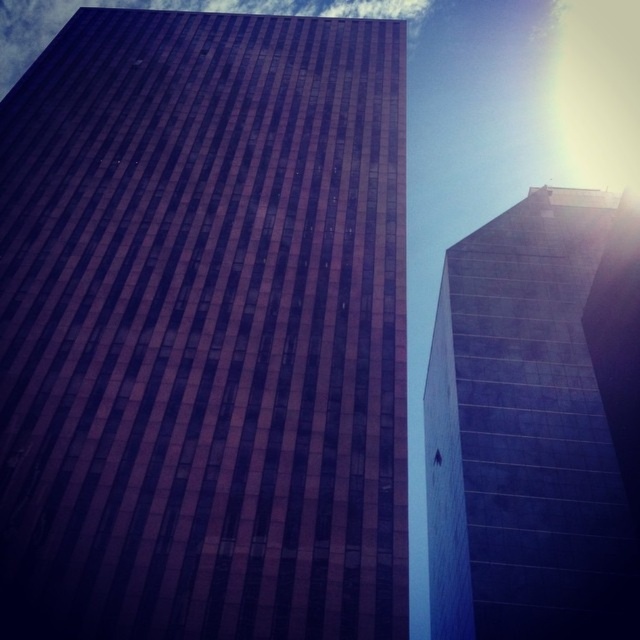
Is point (60, 257) farther from viewer compared to point (483, 282)?

No.

This screenshot has height=640, width=640. What are the coordinates of `brown glass building at center` in the screenshot? It's located at (205, 326).